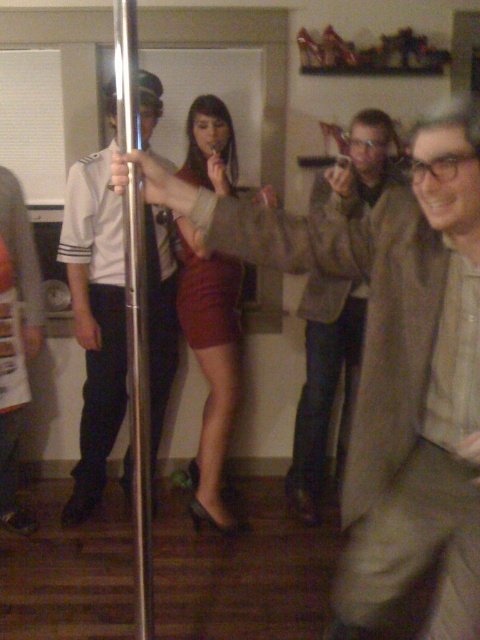
Which is in front, point (367, 115) or point (113, 8)?

Positioned in front is point (113, 8).

Does brown suede jacket at center have a greater width compared to metallic pole at center?

Indeed, brown suede jacket at center has a greater width compared to metallic pole at center.

Is point (288, 493) positioned behind point (137, 317)?

Yes, it is behind point (137, 317).

This screenshot has width=480, height=640. Find the location of `brown suede jacket at center`. brown suede jacket at center is located at coordinates (324, 384).

Who is shorter, matte brown jacket at center or metallic pole at center?

With less height is metallic pole at center.

Is matte brown jacket at center above metallic pole at center?

No, matte brown jacket at center is not above metallic pole at center.

Is point (467, 342) positioned after point (136, 115)?

Yes.

Where is `matte brown jacket at center`? The width and height of the screenshot is (480, 640). matte brown jacket at center is located at coordinates (391, 365).

Who is lower down, burgundy satin skirt at center or metallic pole at center?

metallic pole at center is lower down.

Does burgundy satin skirt at center have a larger size compared to metallic pole at center?

Indeed, burgundy satin skirt at center has a larger size compared to metallic pole at center.

Is point (226, 317) positioned before point (133, 106)?

No, (226, 317) is further to viewer.

Image resolution: width=480 pixels, height=640 pixels. Find the location of `burgundy satin skirt at center`. burgundy satin skirt at center is located at coordinates (211, 364).